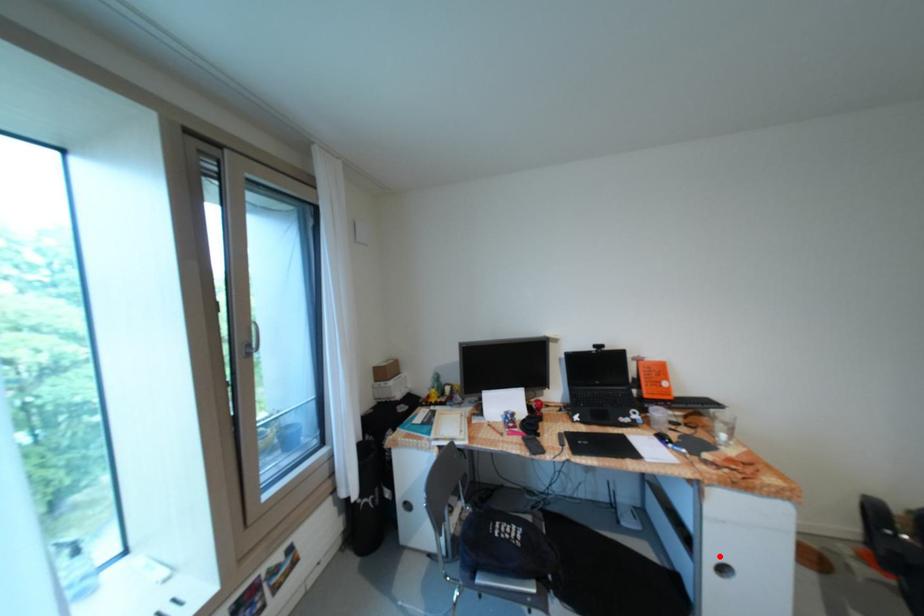
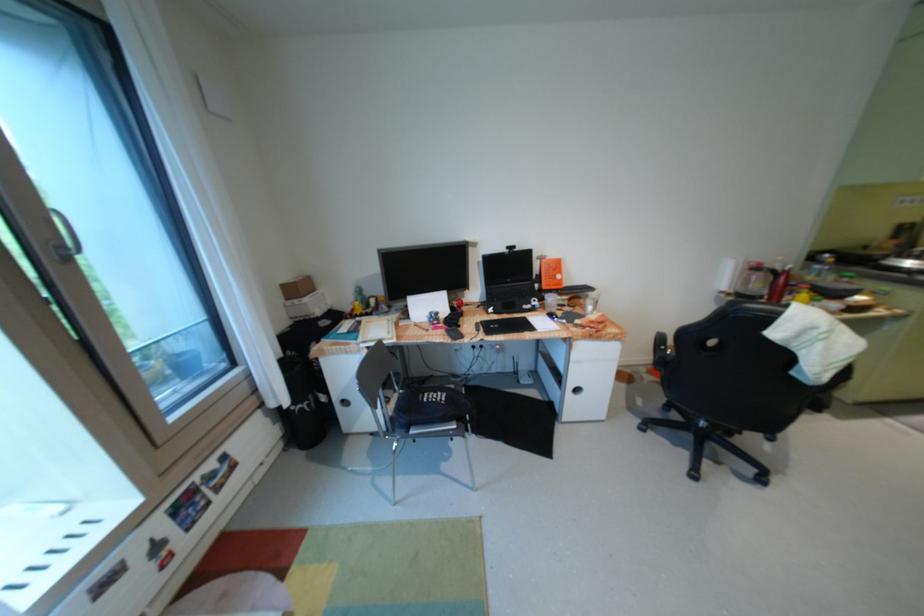
Find the pixel in the second image that matches the highlighted location in the first image.

(580, 386)